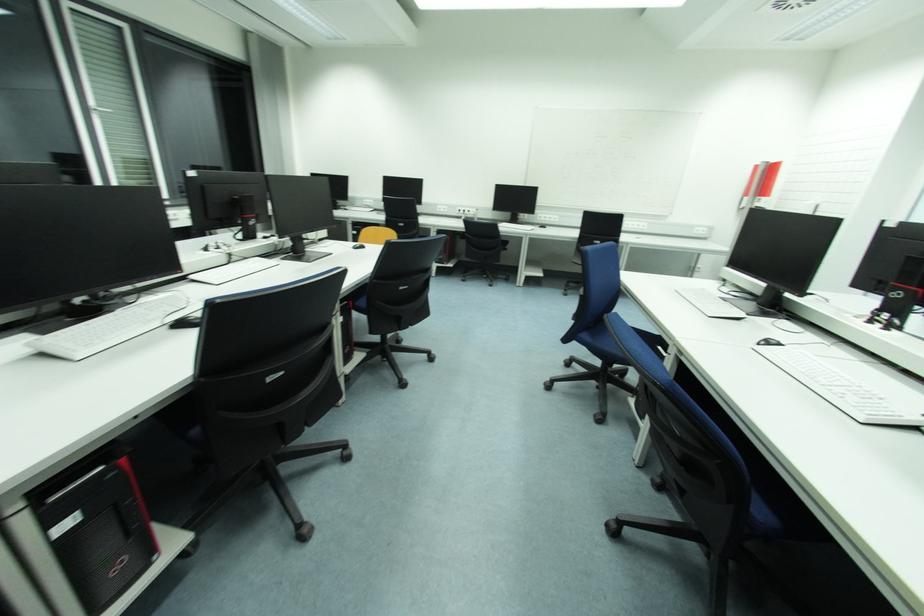
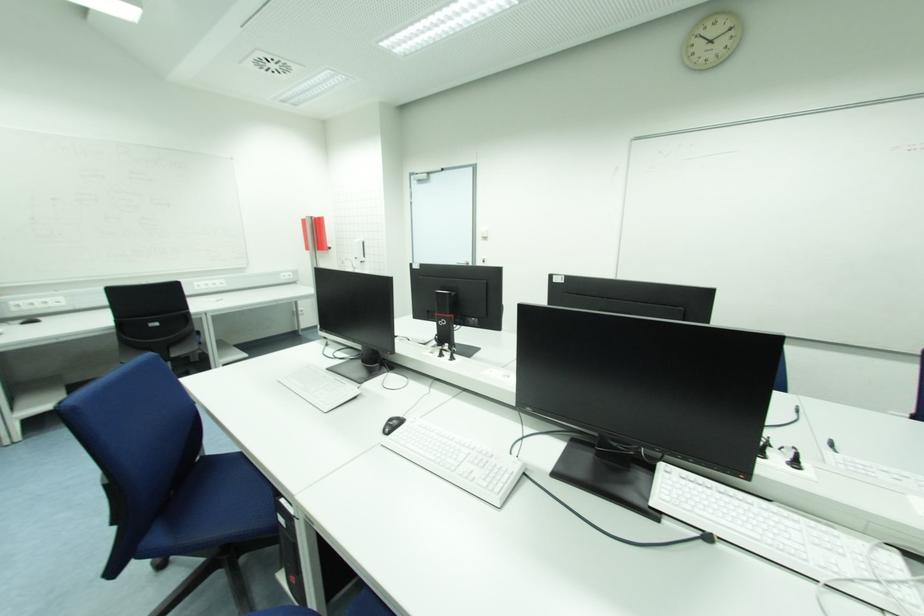
Find the pixel in the second image that matches point (784, 347) in the first image.

(405, 422)